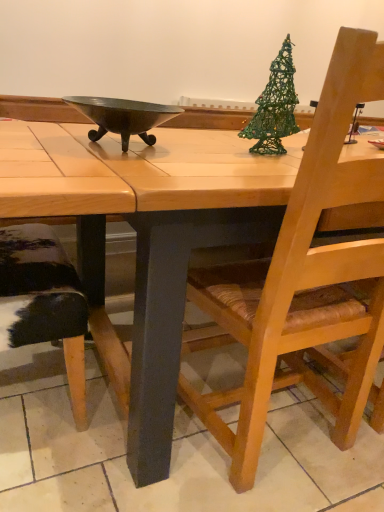
This screenshot has height=512, width=384. What do you see at coordinates (275, 106) in the screenshot?
I see `green wire christmas tree at upper right` at bounding box center [275, 106].

The width and height of the screenshot is (384, 512). What do you see at coordinates (145, 240) in the screenshot? I see `wooden table at center` at bounding box center [145, 240].

The image size is (384, 512). Describe the element at coordinates (123, 117) in the screenshot. I see `metallic dark gray bowl at center` at that location.

Image resolution: width=384 pixels, height=512 pixels. I want to click on green wire christmas tree at upper right, so click(x=275, y=106).

From a real-world perspective, is metallic dark gray bowl at center on top of wooden table at center?

Correct, in the physical world, metallic dark gray bowl at center is higher than wooden table at center.

Is wooden table at center a part of metallic dark gray bowl at center?

No, wooden table at center is not surrounded by metallic dark gray bowl at center.

Can you confirm if metallic dark gray bowl at center is bigger than wooden table at center?

Actually, metallic dark gray bowl at center might be smaller than wooden table at center.

Which of these two, wooden chair with woven seat at right or wooden table at center, is bigger?

With larger size is wooden table at center.

Are wooden chair with woven seat at right and wooden table at center far apart?

They are positioned close to each other.

Which point is more distant from viewer, [314,307] or [365,211]?

The point [314,307] is farther.

What are the coordinates of `christmas tree on the right of metallic dark gray bowl at center` in the screenshot? It's located at (275, 106).

Is green wire christmas tree at upper right smaller than metallic dark gray bowl at center?

No.

Would you say metallic dark gray bowl at center is part of green wire christmas tree at upper right's contents?

No, metallic dark gray bowl at center is located outside of green wire christmas tree at upper right.

Can you confirm if green wire christmas tree at upper right is shorter than metallic dark gray bowl at center?

Incorrect, the height of green wire christmas tree at upper right does not fall short of that of metallic dark gray bowl at center.

Is point (147, 113) positioned behind point (296, 191)?

Yes, point (147, 113) is farther from viewer.

Looking at this image, is metallic dark gray bowl at center to the left of wooden chair with woven seat at right from the viewer's perspective?

Indeed, metallic dark gray bowl at center is positioned on the left side of wooden chair with woven seat at right.

Where is `chair directly beneath the metallic dark gray bowl at center (from a real-world perspective)`? Image resolution: width=384 pixels, height=512 pixels. chair directly beneath the metallic dark gray bowl at center (from a real-world perspective) is located at coordinates (302, 280).

Which of these two, metallic dark gray bowl at center or green wire christmas tree at upper right, is bigger?

green wire christmas tree at upper right is bigger.

Which of these two, metallic dark gray bowl at center or green wire christmas tree at upper right, is wider?

metallic dark gray bowl at center.

Is metallic dark gray bowl at center positioned far away from green wire christmas tree at upper right?

That's not correct — metallic dark gray bowl at center is a little close to green wire christmas tree at upper right.

The height and width of the screenshot is (512, 384). I want to click on christmas tree located behind the metallic dark gray bowl at center, so click(275, 106).

Is wooden table at center facing towards green wire christmas tree at upper right?

No, wooden table at center is not facing towards green wire christmas tree at upper right.

Considering the relative positions of wooden table at center and green wire christmas tree at upper right in the image provided, is wooden table at center to the right of green wire christmas tree at upper right from the viewer's perspective?

Indeed, wooden table at center is positioned on the right side of green wire christmas tree at upper right.

From the image's perspective, which is below, wooden table at center or green wire christmas tree at upper right?

wooden table at center, from the image's perspective.

Would you consider wooden table at center to be distant from green wire christmas tree at upper right?

That's not correct — wooden table at center is a little close to green wire christmas tree at upper right.

Is wooden table at center at the right side of metallic dark gray bowl at center?

Yes.

Between wooden table at center and metallic dark gray bowl at center, which one has larger size?

wooden table at center.

Could you tell me if wooden table at center is turned towards metallic dark gray bowl at center?

No, wooden table at center is not aimed at metallic dark gray bowl at center.

The height and width of the screenshot is (512, 384). In order to click on bowl above the wooden table at center (from a real-world perspective) in this screenshot , I will do `click(123, 117)`.

You are a GUI agent. You are given a task and a screenshot of the screen. Output one action in this format:
    pyautogui.click(x=<x>, y=<y>)
    Task: Click on the chair on the left of wooden table at center
    The image size is (384, 512).
    Given the screenshot: What is the action you would take?
    pyautogui.click(x=302, y=280)

From the picture: Considering their positions, is metallic dark gray bowl at center positioned closer to wooden table at center than green wire christmas tree at upper right?

metallic dark gray bowl at center.

Looking at this image, when comparing their distances from wooden table at center, does metallic dark gray bowl at center or wooden chair with woven seat at right seem closer?

Based on the image, metallic dark gray bowl at center appears to be nearer to wooden table at center.

Looking at the image, which one is located further to green wire christmas tree at upper right, wooden table at center or metallic dark gray bowl at center?

The object further to green wire christmas tree at upper right is wooden table at center.

Based on their spatial positions, is green wire christmas tree at upper right or metallic dark gray bowl at center closer to wooden chair with woven seat at right?

green wire christmas tree at upper right lies closer to wooden chair with woven seat at right than the other object.

Which object lies nearer to the anchor point metallic dark gray bowl at center, wooden chair with woven seat at right or wooden table at center?

Based on the image, wooden table at center appears to be nearer to metallic dark gray bowl at center.

Estimate the real-world distances between objects in this image. Which object is further from metallic dark gray bowl at center, wooden chair with woven seat at right or green wire christmas tree at upper right?

wooden chair with woven seat at right.

From the image, which object appears to be nearer to metallic dark gray bowl at center, green wire christmas tree at upper right or wooden chair with woven seat at right?

Based on the image, green wire christmas tree at upper right appears to be nearer to metallic dark gray bowl at center.

Considering their positions, is green wire christmas tree at upper right positioned further to wooden table at center than wooden chair with woven seat at right?

Among the two, green wire christmas tree at upper right is located further to wooden table at center.

Where is `bowl between green wire christmas tree at upper right and wooden chair with woven seat at right vertically`? bowl between green wire christmas tree at upper right and wooden chair with woven seat at right vertically is located at coordinates (123, 117).

Image resolution: width=384 pixels, height=512 pixels. In order to click on chair between metallic dark gray bowl at center and wooden table at center in this screenshot , I will do `click(302, 280)`.

Where is `christmas tree between metallic dark gray bowl at center and wooden table at center in the horizontal direction`? christmas tree between metallic dark gray bowl at center and wooden table at center in the horizontal direction is located at coordinates (275, 106).

Find the location of `desk between green wire christmas tree at upper right and wooden chair with woven seat at right in the up-down direction`. desk between green wire christmas tree at upper right and wooden chair with woven seat at right in the up-down direction is located at coordinates (145, 240).